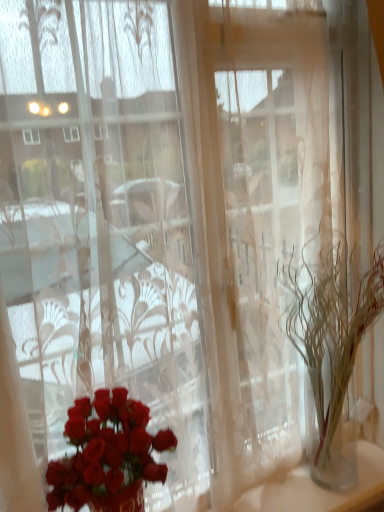
I want to click on shiny red roses at lower left, so click(x=108, y=455).

Describe the element at coordinates (108, 455) in the screenshot. I see `shiny red roses at lower left` at that location.

This screenshot has width=384, height=512. In order to click on translucent glass vase at right in this screenshot , I will do `click(330, 344)`.

The width and height of the screenshot is (384, 512). What do you see at coordinates (330, 344) in the screenshot?
I see `translucent glass vase at right` at bounding box center [330, 344].

Locate an element on the screen. The image size is (384, 512). shiny red roses at lower left is located at coordinates (108, 455).

Does shiny red roses at lower left appear on the right side of translucent glass vase at right?

In fact, shiny red roses at lower left is to the left of translucent glass vase at right.

Does shiny red roses at lower left lie behind translucent glass vase at right?

No, shiny red roses at lower left is closer to the camera.

Considering the positions of point (76, 429) and point (308, 326), is point (76, 429) closer or farther from the camera than point (308, 326)?

Point (76, 429).

From the image's perspective, which is above, shiny red roses at lower left or translucent glass vase at right?

From the image's view, translucent glass vase at right is above.

From a real-world perspective, between shiny red roses at lower left and translucent glass vase at right, who is vertically lower?

shiny red roses at lower left.

Is shiny red roses at lower left thinner than translucent glass vase at right?

Correct, the width of shiny red roses at lower left is less than that of translucent glass vase at right.

Considering the sizes of objects shiny red roses at lower left and translucent glass vase at right in the image provided, who is taller, shiny red roses at lower left or translucent glass vase at right?

translucent glass vase at right is taller.

Considering the sizes of objects shiny red roses at lower left and translucent glass vase at right in the image provided, who is bigger, shiny red roses at lower left or translucent glass vase at right?

With larger size is translucent glass vase at right.

Is shiny red roses at lower left inside or outside of translucent glass vase at right?

shiny red roses at lower left is not enclosed by translucent glass vase at right.

Can you see shiny red roses at lower left touching translucent glass vase at right?

shiny red roses at lower left and translucent glass vase at right are clearly separated.

Could you tell me if shiny red roses at lower left is facing translucent glass vase at right?

No, shiny red roses at lower left is not oriented towards translucent glass vase at right.

What's the angular difference between shiny red roses at lower left and translucent glass vase at right's facing directions?

There is a 1.6-degree angle between the facing directions of shiny red roses at lower left and translucent glass vase at right.

Measure the distance from shiny red roses at lower left to translucent glass vase at right.

A distance of 24.04 inches exists between shiny red roses at lower left and translucent glass vase at right.

This screenshot has width=384, height=512. What are the coordinates of `flower below the translucent glass vase at right (from a real-world perspective)` in the screenshot? It's located at (108, 455).

Is translucent glass vase at right to the left of shiny red roses at lower left from the viewer's perspective?

No.

Relative to shiny red roses at lower left, is translucent glass vase at right in front or behind?

translucent glass vase at right is behind shiny red roses at lower left.

Is point (297, 350) in front of point (126, 400)?

No, it is not.

From the image's perspective, is translucent glass vase at right under shiny red roses at lower left?

Actually, translucent glass vase at right appears above shiny red roses at lower left in the image.

From a real-world perspective, is translucent glass vase at right physically below shiny red roses at lower left?

Incorrect, from a real-world perspective, translucent glass vase at right is higher than shiny red roses at lower left.

Which of these two, translucent glass vase at right or shiny red roses at lower left, is wider?

translucent glass vase at right.

In terms of height, does translucent glass vase at right look taller or shorter compared to shiny red roses at lower left?

Considering their sizes, translucent glass vase at right has more height than shiny red roses at lower left.

Can you confirm if translucent glass vase at right is bigger than shiny red roses at lower left?

Indeed, translucent glass vase at right has a larger size compared to shiny red roses at lower left.

Is translucent glass vase at right outside of shiny red roses at lower left?

Yes, translucent glass vase at right is not within shiny red roses at lower left.

Is translucent glass vase at right in contact with shiny red roses at lower left?

No, translucent glass vase at right is not with shiny red roses at lower left.

Is shiny red roses at lower left at the back of translucent glass vase at right?

No, translucent glass vase at right is not facing away from shiny red roses at lower left.

Where is `houseplant that appears on the right of shiny red roses at lower left`? This screenshot has width=384, height=512. houseplant that appears on the right of shiny red roses at lower left is located at coordinates (330, 344).

In the image, there is a shiny red roses at lower left. Identify the location of houseplant above it (from the image's perspective). (330, 344).

You are a GUI agent. You are given a task and a screenshot of the screen. Output one action in this format:
    pyautogui.click(x=<x>, y=<y>)
    Task: Click on the flower on the left of translucent glass vase at right
    This screenshot has height=512, width=384.
    Given the screenshot: What is the action you would take?
    pyautogui.click(x=108, y=455)